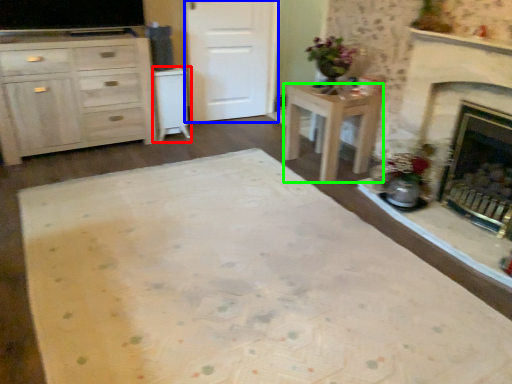
Question: Which is farther away from cabinetry (highlighted by a red box)? door (highlighted by a blue box) or desk (highlighted by a green box)?

Choices:
 (A) door
 (B) desk

Answer: (B)